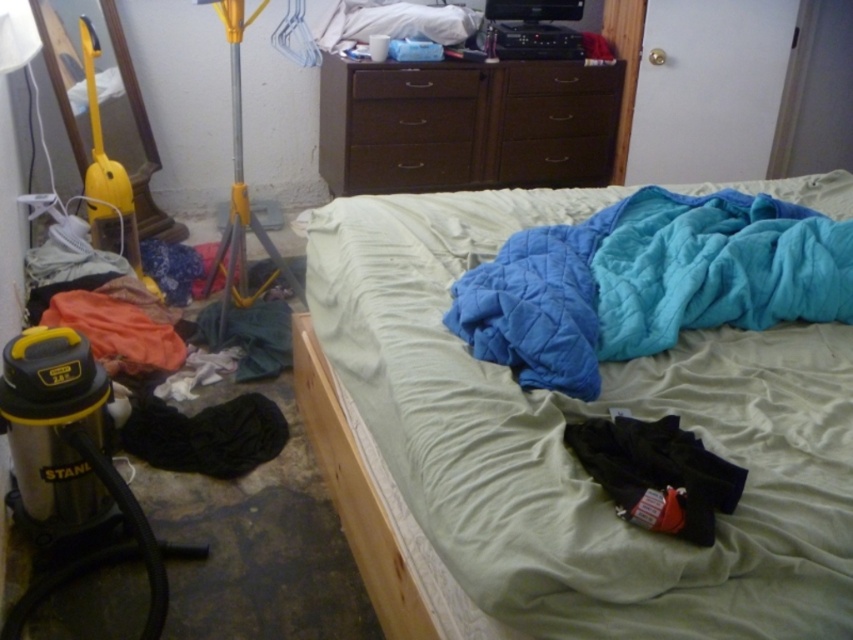
Question: Is quilted blue blanket at center wider than black cotton pants at lower right?

Choices:
 (A) yes
 (B) no

Answer: (A)

Question: Which of the following is the closest to the observer?

Choices:
 (A) [509, 134]
 (B) [457, 323]

Answer: (B)

Question: Is quilted fabric bed at center to the right of dark wood dresser at upper center from the viewer's perspective?

Choices:
 (A) no
 (B) yes

Answer: (B)

Question: Is quilted blue blanket at center above dark wood dresser at upper center?

Choices:
 (A) no
 (B) yes

Answer: (A)

Question: Which point is farther to the camera?

Choices:
 (A) black cotton pants at lower right
 (B) quilted fabric bed at center

Answer: (A)

Question: Which object appears farthest from the camera in this image?

Choices:
 (A) quilted blue blanket at center
 (B) black cotton pants at lower right
 (C) dark wood dresser at upper center
 (D) quilted fabric bed at center

Answer: (C)